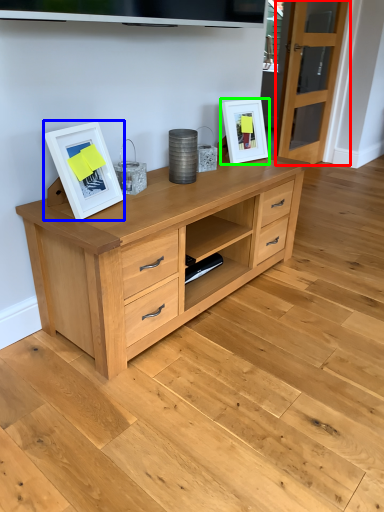
Question: Which object is the closest to the glass door (highlighted by a red box)? Choose among these: picture frame (highlighted by a blue box) or picture frame (highlighted by a green box).

Choices:
 (A) picture frame
 (B) picture frame

Answer: (B)